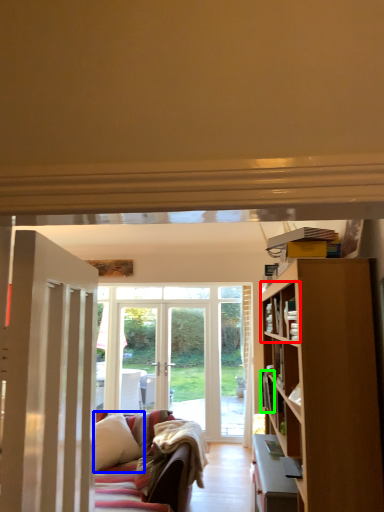
Question: Considering the real-world distances, which object is farthest from shelf (highlighted by a red box)? pillow (highlighted by a blue box) or book (highlighted by a green box)?

Choices:
 (A) pillow
 (B) book

Answer: (A)